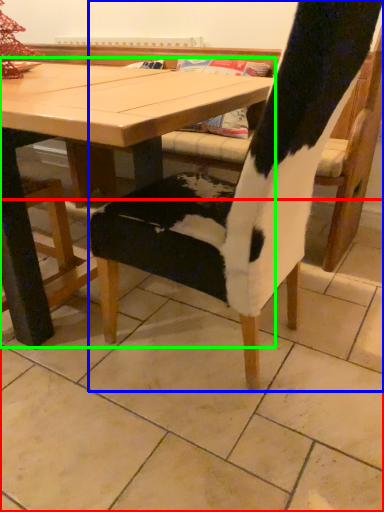
Question: Which object is positioned farthest from tile (highlighted by a red box)? Select from chair (highlighted by a blue box) and table (highlighted by a green box).

Choices:
 (A) chair
 (B) table

Answer: (B)